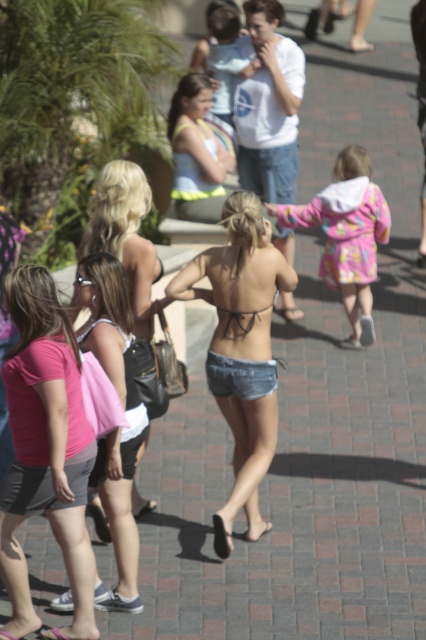
You are a photographer trying to capture a shot of the pink fabric shorts at lower left and the fluffy pink coat at center. Which object should you focus on first if you want to include both in your frame without moving the camera?

The pink fabric shorts at lower left is located below the fluffy pink coat at center, so you should focus on the fluffy pink coat at center first to ensure both are in frame without moving the camera.

You are a photographer trying to capture a photo of the pink fabric shorts at lower left and the fluffy pink coat at center. Which object should you focus on first if you want to ensure both are in the frame without moving the camera? Please explain your reasoning based on their sizes in the image.

The pink fabric shorts at lower left is much taller than the fluffy pink coat at center. Therefore, focusing on the pink fabric shorts at lower left first would ensure it fits within the frame, as it occupies more vertical space, making it easier to adjust the camera angle to include the smaller fluffy pink coat at center without moving the camera.